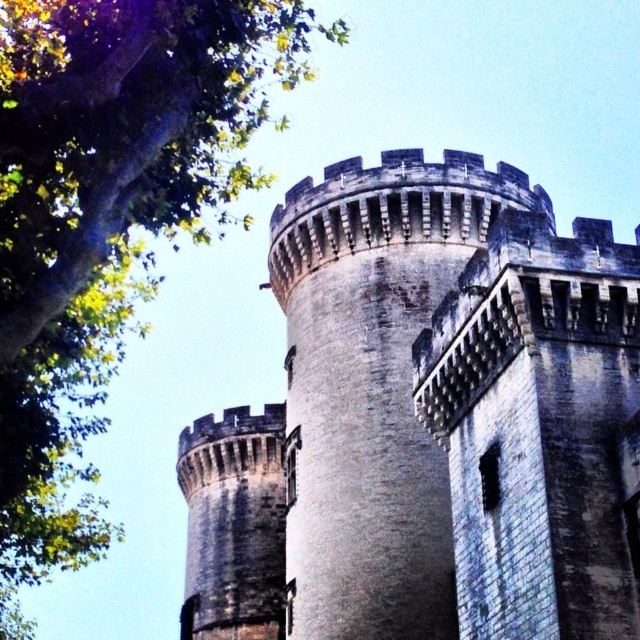
Question: Which object appears closest to the camera in this image?

Choices:
 (A) gray stone castle at center
 (B) green leafy tree at upper left

Answer: (A)

Question: Is gray stone castle at center positioned at the back of green leafy tree at upper left?

Choices:
 (A) yes
 (B) no

Answer: (B)

Question: Is gray stone castle at center above green leafy tree at upper left?

Choices:
 (A) yes
 (B) no

Answer: (B)

Question: Can you confirm if gray stone castle at center is positioned to the left of green leafy tree at upper left?

Choices:
 (A) no
 (B) yes

Answer: (A)